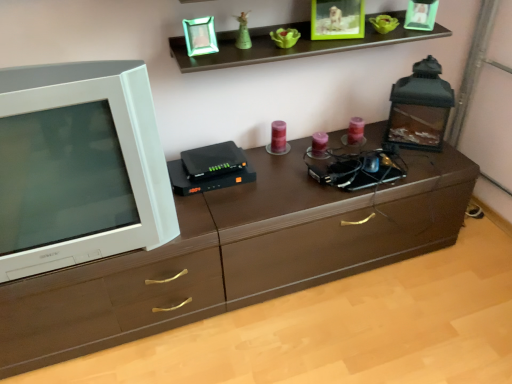
Question: From the image's perspective, is green glossy statue at upper center above or below brown wood chest of drawers at center?

Choices:
 (A) above
 (B) below

Answer: (A)

Question: Is green glossy statue at upper center bigger or smaller than brown wood chest of drawers at center?

Choices:
 (A) big
 (B) small

Answer: (B)

Question: Which is nearer to the white glossy television at left?

Choices:
 (A) green glossy statue at upper center
 (B) brown wood chest of drawers at center

Answer: (B)

Question: Which of these objects is positioned closest to the brown wood chest of drawers at center?

Choices:
 (A) white glossy television at left
 (B) green glossy statue at upper center

Answer: (A)